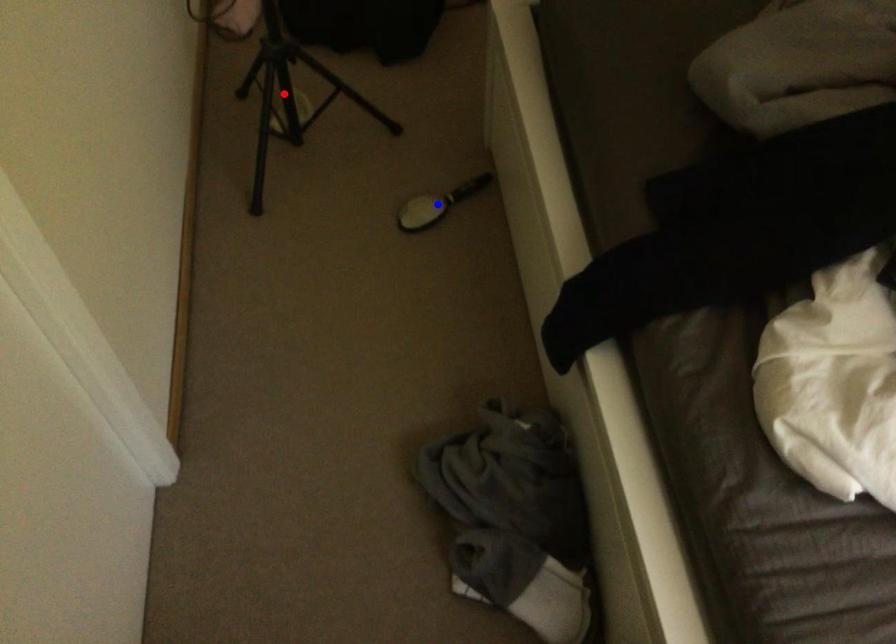
Question: In the image, two points are highlighted. Which point is nearer to the camera? Reply with the corresponding letter.

Choices:
 (A) blue point
 (B) red point

Answer: (A)